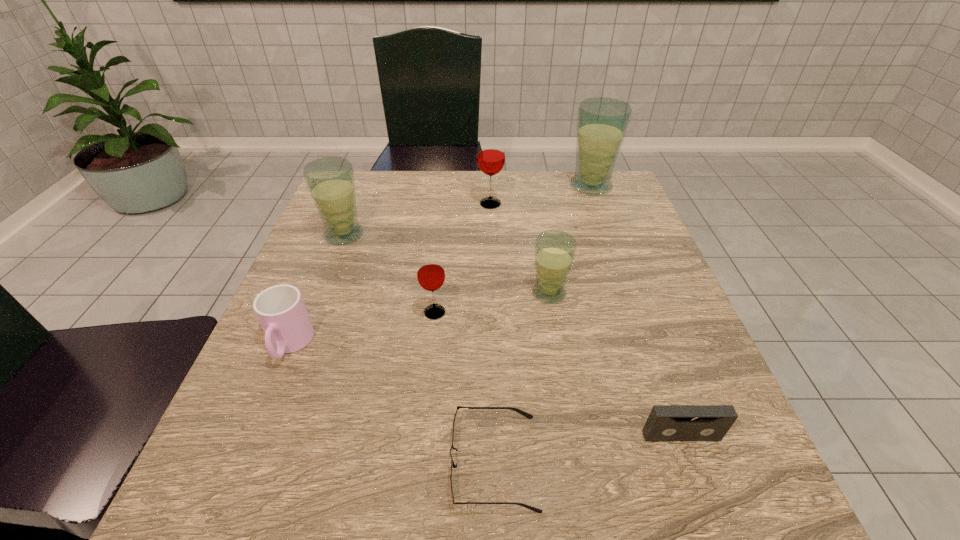
This screenshot has height=540, width=960. Identify the location of the biggest blue glass. 602,122.

Where is `the tallest glass`? the tallest glass is located at coordinates tap(602, 122).

Locate an element on the screen. the third glass from left to right is located at coordinates (491, 151).

The height and width of the screenshot is (540, 960). Identify the location of the bigger red glass. (491, 151).

You are a GUI agent. You are given a task and a screenshot of the screen. Output one action in this format:
    pyautogui.click(x=<x>, y=<y>)
    Task: Click on the third farthest glass
    The height and width of the screenshot is (540, 960).
    Given the screenshot: What is the action you would take?
    pyautogui.click(x=330, y=181)

Where is `the leftmost glass`? The width and height of the screenshot is (960, 540). the leftmost glass is located at coordinates (330, 181).

At what (x,y) coordinates should I click in order to perform the action: click on the second glass from right to left. Please return your answer as a coordinate pair (x, y). Image resolution: width=960 pixels, height=540 pixels. Looking at the image, I should click on (555, 250).

This screenshot has width=960, height=540. I want to click on the sixth object from left to right, so click(555, 250).

Identify the location of the left red glass. (431, 275).

I want to click on the nearer red glass, so click(x=431, y=275).